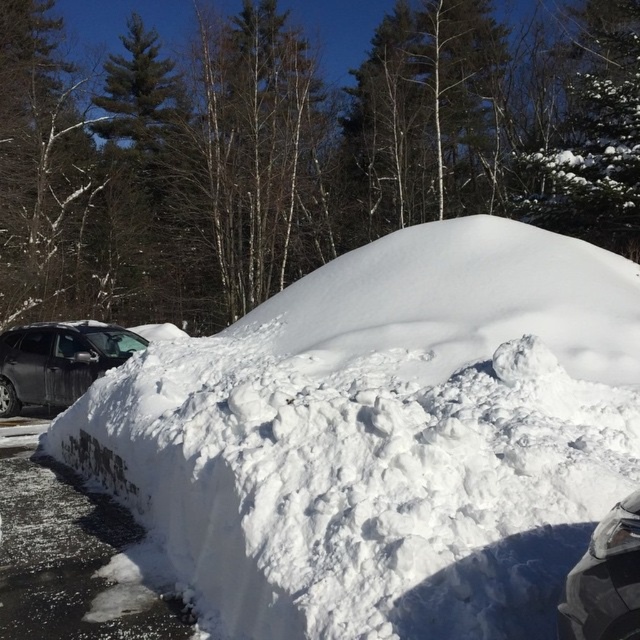
Who is higher up, matte black suv at left or glossy black car at lower right?

matte black suv at left is higher up.

Which is more to the right, matte black suv at left or glossy black car at lower right?

From the viewer's perspective, glossy black car at lower right appears more on the right side.

Who is more distant from viewer, (x=45, y=404) or (x=609, y=554)?

The point (x=45, y=404) is behind.

Find the location of a particular element. matte black suv at left is located at coordinates (58, 362).

Is point (301, 580) positioned after point (572, 572)?

Yes, it is behind point (572, 572).

Which is above, white fluffy snow at center or glossy black car at lower right?

white fluffy snow at center is higher up.

What do you see at coordinates (381, 438) in the screenshot?
I see `white fluffy snow at center` at bounding box center [381, 438].

Find the location of a particular element. white fluffy snow at center is located at coordinates (381, 438).

Does white fluffy snow at center appear over matte black suv at left?

Indeed, white fluffy snow at center is positioned over matte black suv at left.

In the scene shown: Is white fluffy snow at center bigger than matte black suv at left?

Yes.

Identify the location of white fluffy snow at center. (381, 438).